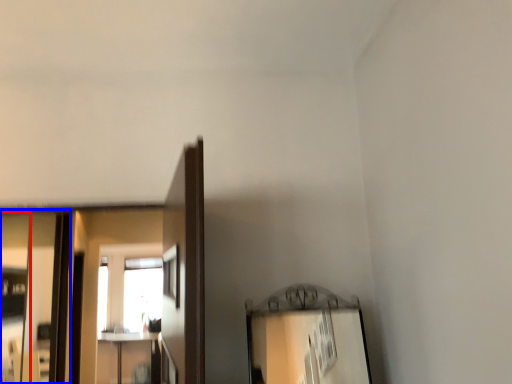
Question: Which object is closer to the camera taking this photo, mirror (highlighted by a red box) or mirror (highlighted by a blue box)?

Choices:
 (A) mirror
 (B) mirror

Answer: (A)